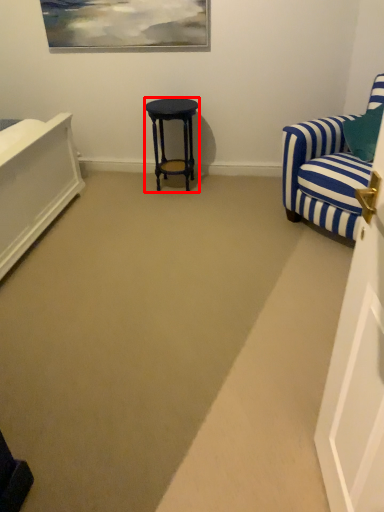
Question: Observing the image, what is the correct spatial positioning of stool (annotated by the red box) in reference to chair?

Choices:
 (A) left
 (B) right

Answer: (A)